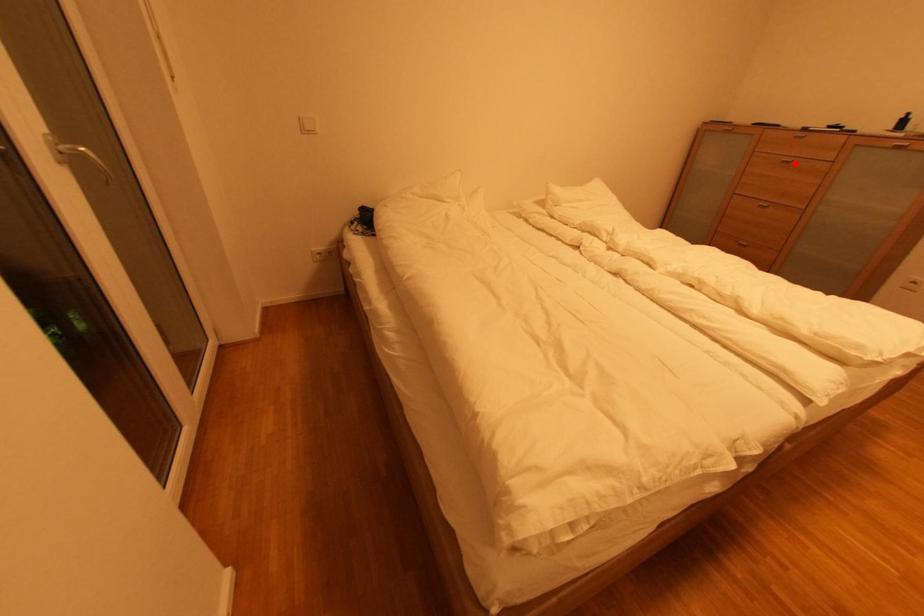
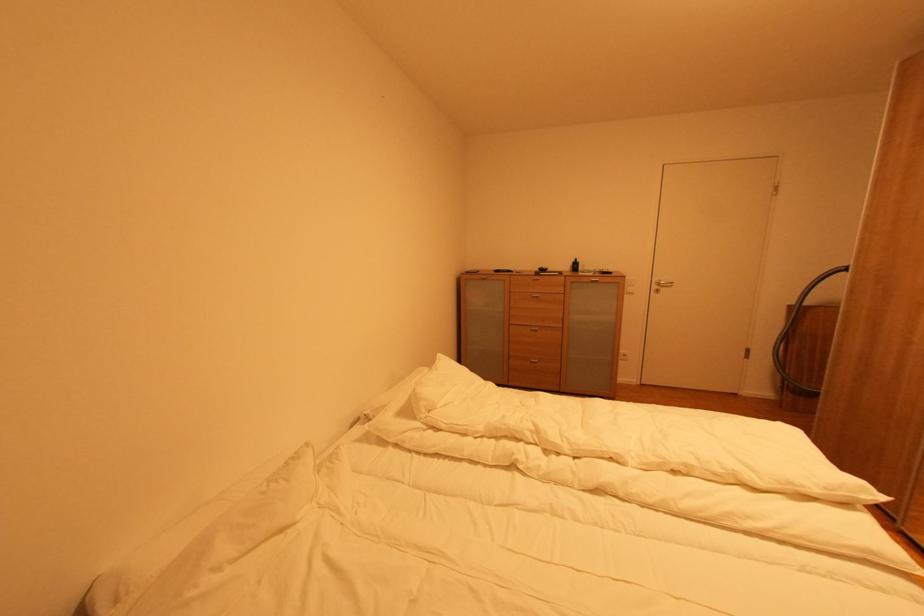
Question: I am providing you with two images of the same scene from different viewpoints. Given a red point in image1, look at the same physical point in image2. Is it:

Choices:
 (A) Closer to the viewpoint
 (B) Farther from the viewpoint

Answer: (A)